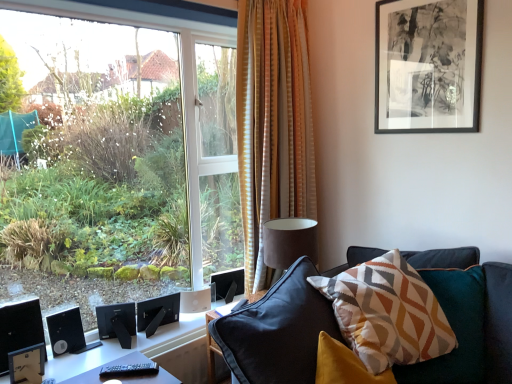
Where is `vacant area that is in front of black matte speaker at lower left, which is the 1th speaker in left-to-right order`? vacant area that is in front of black matte speaker at lower left, which is the 1th speaker in left-to-right order is located at coordinates (63, 368).